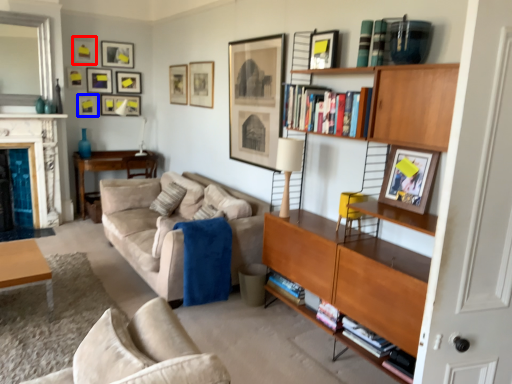
Question: Which point is further to the camera, picture frame (highlighted by a red box) or picture frame (highlighted by a blue box)?

Choices:
 (A) picture frame
 (B) picture frame

Answer: (B)